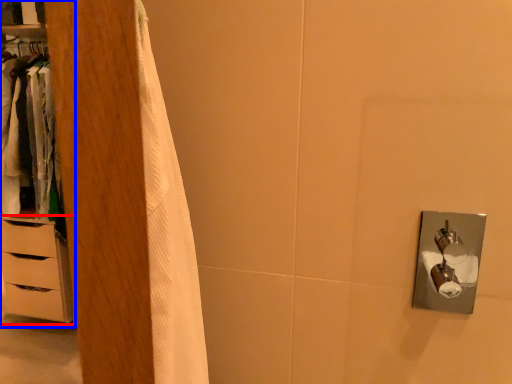
Question: Which point is closer to the camera, chest of drawers (highlighted by a red box) or dresser (highlighted by a blue box)?

Choices:
 (A) chest of drawers
 (B) dresser

Answer: (B)